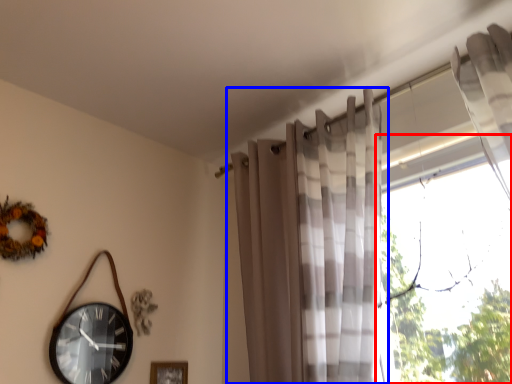
Question: Which object appears farthest to the camera in this image, window (highlighted by a red box) or curtain (highlighted by a blue box)?

Choices:
 (A) window
 (B) curtain

Answer: (B)